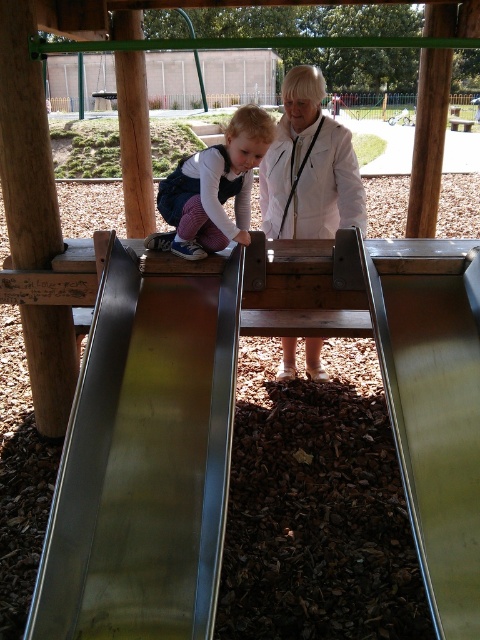
Who is positioned more to the right, metallic smooth slide at upper left or matte purple pants at center?

Positioned to the right is matte purple pants at center.

In the scene shown: Which of these two, metallic smooth slide at upper left or matte purple pants at center, stands shorter?

Standing shorter between the two is matte purple pants at center.

What do you see at coordinates (144, 461) in the screenshot?
I see `metallic smooth slide at upper left` at bounding box center [144, 461].

This screenshot has width=480, height=640. Find the location of `metallic smooth slide at upper left`. metallic smooth slide at upper left is located at coordinates pyautogui.click(x=144, y=461).

Who is more distant from viewer, (72,460) or (299,112)?

The point (299,112) is more distant.

Does point (139, 465) lie behind point (287, 179)?

No.

The height and width of the screenshot is (640, 480). Identify the location of metallic smooth slide at upper left. [x=144, y=461].

Is white matte jacket at center further to camera compared to matte purple pants at center?

Yes, white matte jacket at center is further from the viewer.

Does white matte jacket at center have a larger size compared to matte purple pants at center?

Correct, white matte jacket at center is larger in size than matte purple pants at center.

Is point (336, 188) more distant than point (266, 129)?

Yes, it is.

Where is `white matte jacket at center`? This screenshot has width=480, height=640. white matte jacket at center is located at coordinates 309,168.